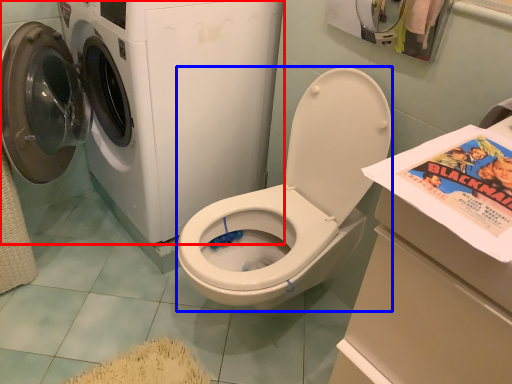
Question: Which object appears farthest to the camera in this image, washing machine (highlighted by a red box) or washer (highlighted by a blue box)?

Choices:
 (A) washing machine
 (B) washer

Answer: (A)